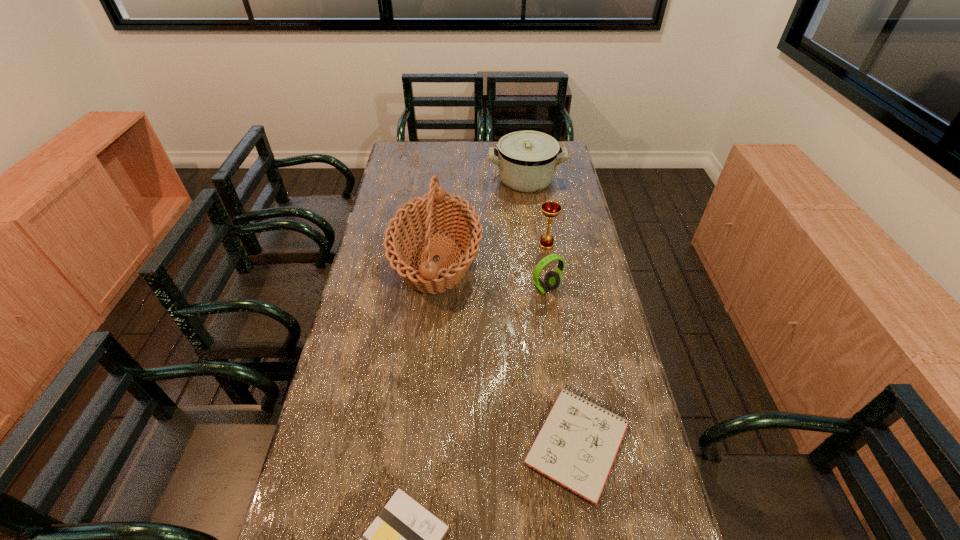
Image resolution: width=960 pixels, height=540 pixels. What are the coordinates of `vacant area located 0.330m on the back of the right notepad` in the screenshot? It's located at (554, 298).

Find the location of `object at the far edge`. object at the far edge is located at coordinates (527, 160).

Locate an element on the screen. object situated at the left edge is located at coordinates (435, 212).

Find the location of a particular element. The image size is (960, 540). saucepan that is at the right edge is located at coordinates (527, 160).

This screenshot has height=540, width=960. Identify the location of chalice that is at the right edge. (550, 209).

Where is `headset that is at the right edge`? The width and height of the screenshot is (960, 540). headset that is at the right edge is located at coordinates (552, 279).

Where is `notepad positioned at the right edge`? notepad positioned at the right edge is located at coordinates (576, 446).

I want to click on object at the far right corner, so click(x=527, y=160).

You are a GUI agent. You are given a task and a screenshot of the screen. Output one action in this format:
    pyautogui.click(x=<x>, y=<y>)
    Task: Click on the vacant space at the left edge of the desktop
    This screenshot has height=540, width=960.
    Given the screenshot: What is the action you would take?
    pyautogui.click(x=394, y=184)

Where is `vacant space at the right edge`? The image size is (960, 540). vacant space at the right edge is located at coordinates (571, 237).